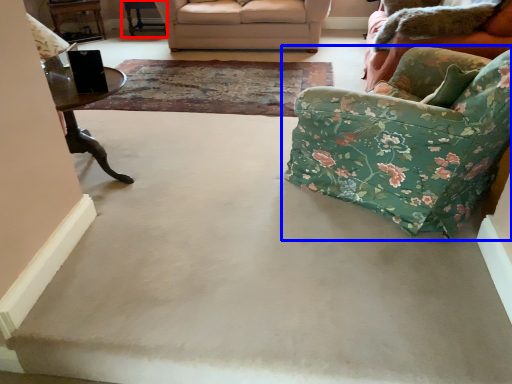
Question: Which object appears closest to the camera in this image, table (highlighted by a red box) or chair (highlighted by a blue box)?

Choices:
 (A) table
 (B) chair

Answer: (B)